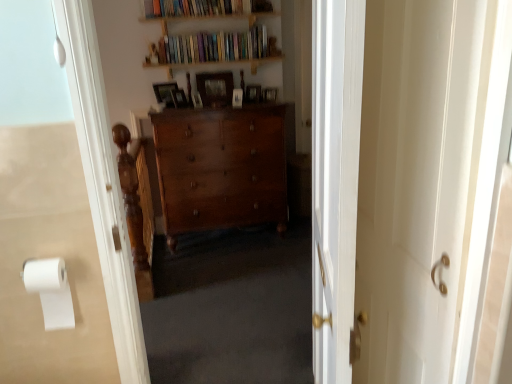
Question: Is hardcover books at upper center, the second book when ordered from top to bottom, at the left side of wooden picture frame at center, which is the second picture frame in left-to-right order?

Choices:
 (A) no
 (B) yes

Answer: (A)

Question: Does hardcover books at upper center, the second book when ordered from top to bottom, lie behind wooden picture frame at center, which is the second picture frame in left-to-right order?

Choices:
 (A) no
 (B) yes

Answer: (A)

Question: From a real-world perspective, is hardcover books at upper center, placed as the first book when sorted from bottom to top, on top of wooden picture frame at center, which is the second picture frame in left-to-right order?

Choices:
 (A) yes
 (B) no

Answer: (A)

Question: Is hardcover books at upper center, the second book when ordered from top to bottom, taller than wooden picture frame at center, acting as the fifth picture frame starting from the right?

Choices:
 (A) no
 (B) yes

Answer: (B)

Question: Does hardcover books at upper center, the second book when ordered from top to bottom, have a lesser height compared to wooden picture frame at center, which is the second picture frame in left-to-right order?

Choices:
 (A) no
 (B) yes

Answer: (A)

Question: Can you confirm if hardcover books at upper center, placed as the first book when sorted from bottom to top, is bigger than wooden picture frame at center, which is the second picture frame in left-to-right order?

Choices:
 (A) no
 (B) yes

Answer: (B)

Question: From a real-world perspective, is wooden picture frame at center, acting as the fifth picture frame starting from the right, below wooden picture frame at center, placed as the fifth picture frame when sorted from left to right?

Choices:
 (A) yes
 (B) no

Answer: (B)

Question: Could you tell me if wooden picture frame at center, which is the second picture frame in left-to-right order, is facing wooden picture frame at center, placed as the fifth picture frame when sorted from left to right?

Choices:
 (A) no
 (B) yes

Answer: (A)

Question: Is wooden picture frame at center, acting as the fifth picture frame starting from the right, completely or partially outside of wooden picture frame at center, placed as the fifth picture frame when sorted from left to right?

Choices:
 (A) yes
 (B) no

Answer: (A)

Question: Can you confirm if wooden picture frame at center, which is the second picture frame in left-to-right order, is positioned to the right of wooden picture frame at center, placed as the fifth picture frame when sorted from left to right?

Choices:
 (A) no
 (B) yes

Answer: (A)

Question: Is the depth of wooden picture frame at center, which is the second picture frame in left-to-right order, less than that of wooden picture frame at center, which ranks as the 2th picture frame in right-to-left order?

Choices:
 (A) no
 (B) yes

Answer: (B)

Question: Is wooden picture frame at center, acting as the fifth picture frame starting from the right, behind wooden picture frame at center, which ranks as the 2th picture frame in right-to-left order?

Choices:
 (A) no
 (B) yes

Answer: (A)

Question: Is wooden picture frame at center, the first picture frame viewed from the right, facing towards wooden bookshelf at upper center, which ranks as the 1th book in top-to-bottom order?

Choices:
 (A) no
 (B) yes

Answer: (A)